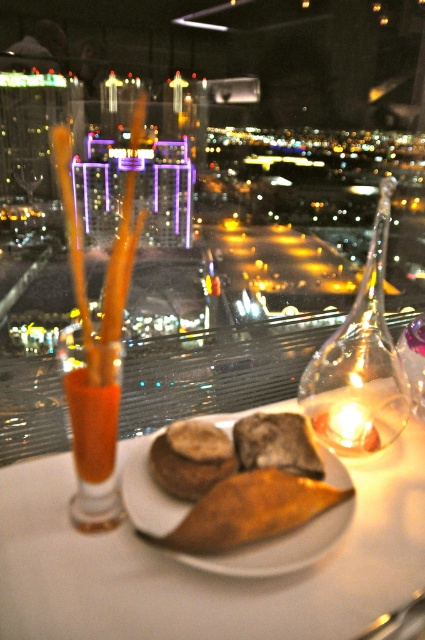
Is point (322, 618) positioned behind point (244, 442)?

No, (322, 618) is in front of (244, 442).

Does point (397, 474) come in front of point (286, 433)?

No, (397, 474) is further to viewer.

The height and width of the screenshot is (640, 425). Describe the element at coordinates (204, 570) in the screenshot. I see `translucent glass plate at center` at that location.

I want to click on translucent glass plate at center, so click(204, 570).

Who is more forward, (108, 365) or (274, 436)?

Point (108, 365)

Can you confirm if translucent orange liquid at left is wider than dark brown crusty bread at center?

Correct, the width of translucent orange liquid at left exceeds that of dark brown crusty bread at center.

What do you see at coordinates (95, 436) in the screenshot? This screenshot has width=425, height=640. I see `translucent orange liquid at left` at bounding box center [95, 436].

I want to click on translucent orange liquid at left, so click(x=95, y=436).

Find the location of a particular element. This screenshot has height=640, width=425. transparent glass carafe at center is located at coordinates (359, 362).

Can you confirm if transparent glass carafe at center is bigger than golden crispy pastry at center?

Yes.

Locate an element on the screen. The width and height of the screenshot is (425, 640). transparent glass carafe at center is located at coordinates (359, 362).

This screenshot has width=425, height=640. What are the coordinates of `transparent glass carafe at center` in the screenshot? It's located at (359, 362).